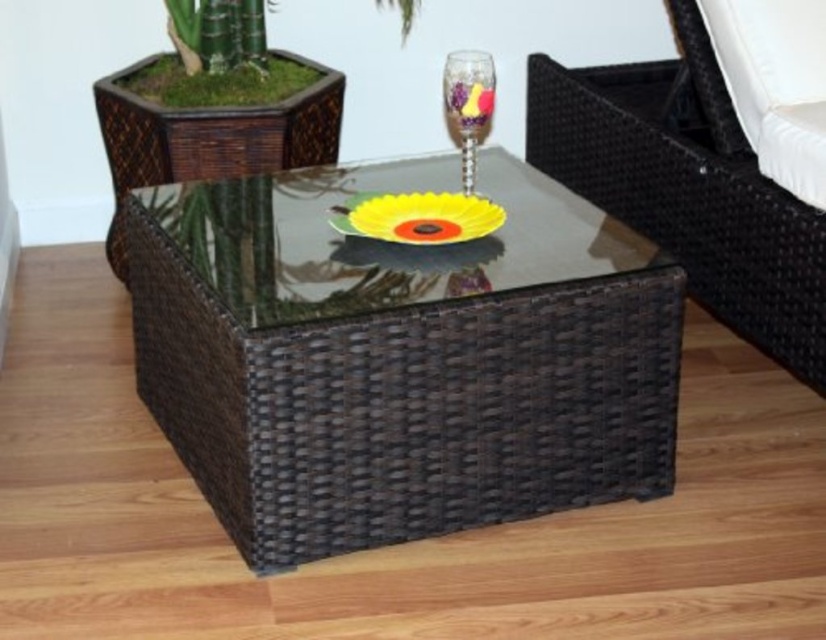
You are a delivery person holding a package that is 1.5 meters long. You need to place it on the brown wicker table at center. Is the package too long to fit on the table?

The distance of brown wicker table at center from camera is 1.46 meters. The package is 1.5 meters long, which is slightly longer than the table, so it won generated. 1. The question should be based on the spatial information provided in the Objects Description without revealing the specific details. The current question mentions the distance from the camera, which isn not part of the Objects Description. The Objects Description only states the distance from the camera. However, the user might be confused.

You are arranging a dinner party and need to place a decorative item on the table. You have a brown wicker chair at center and a translucent glass flower at center. Which item should you move to the left to make space for a centerpiece?

You should move the brown wicker chair at center to the left since it is currently to the right of the translucent glass flower at center, allowing space for the centerpiece.

You are arranging a small party and need to place a centerpiece on the brown wicker table at center. Considering the size of the brown wicker chair at center, will the centerpiece fit comfortably on the table without blocking the chair?

The brown wicker table at center is bigger than the brown wicker chair at center, so the centerpiece should fit comfortably on the table without blocking the chair.